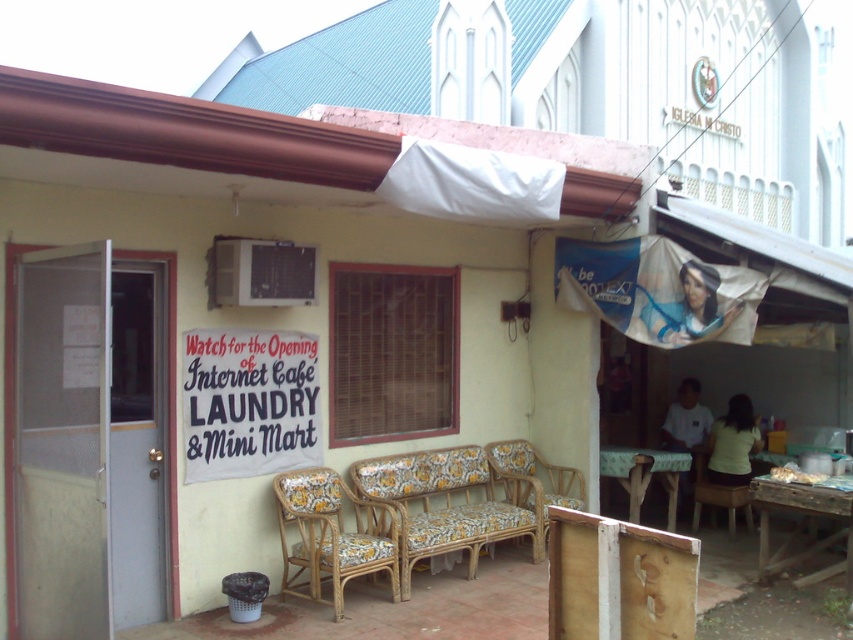
Measure the distance between white paper sign at center and wooden signboard at lower right.

white paper sign at center and wooden signboard at lower right are 9.28 feet apart.

Is white paper sign at center shorter than wooden signboard at lower right?

No.

The height and width of the screenshot is (640, 853). What do you see at coordinates (248, 403) in the screenshot?
I see `white paper sign at center` at bounding box center [248, 403].

Where is `white paper sign at center`? The height and width of the screenshot is (640, 853). white paper sign at center is located at coordinates (248, 403).

Is wooden signboard at lower right bigger than wooden chair at lower right?

Incorrect, wooden signboard at lower right is not larger than wooden chair at lower right.

Who is more distant from viewer, (564, 547) or (729, 524)?

Point (729, 524)

Who is more forward, (624, 566) or (751, 525)?

Positioned in front is point (624, 566).

Identify the location of wooden signboard at lower right. (618, 579).

Can you confirm if yellow floral fabric chair at center is wider than wooden chair at lower right?

Indeed, yellow floral fabric chair at center has a greater width compared to wooden chair at lower right.

Does yellow floral fabric chair at center have a greater height compared to wooden chair at lower right?

No.

Identify the location of yellow floral fabric chair at center. The image size is (853, 640). click(534, 477).

Locate an element on the screen. yellow floral fabric chair at center is located at coordinates (534, 477).